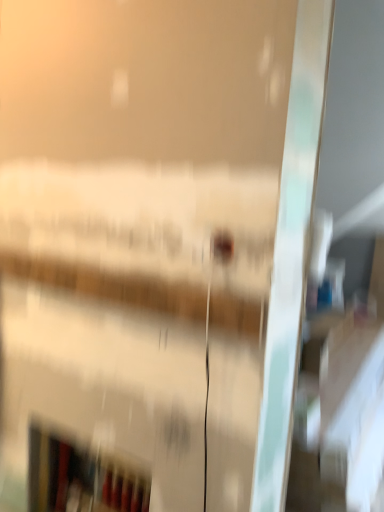
From the picture: Measure the distance between point (34, 451) and camera.

1.59 meters.

Describe the element at coordinates (80, 478) in the screenshot. I see `transparent glass window at lower left` at that location.

Find the location of a particular element. transparent glass window at lower left is located at coordinates (80, 478).

At what (x,y) coordinates should I click in order to perform the action: click on transparent glass window at lower left. Please return your answer as a coordinate pair (x, y). The height and width of the screenshot is (512, 384). Looking at the image, I should click on (80, 478).